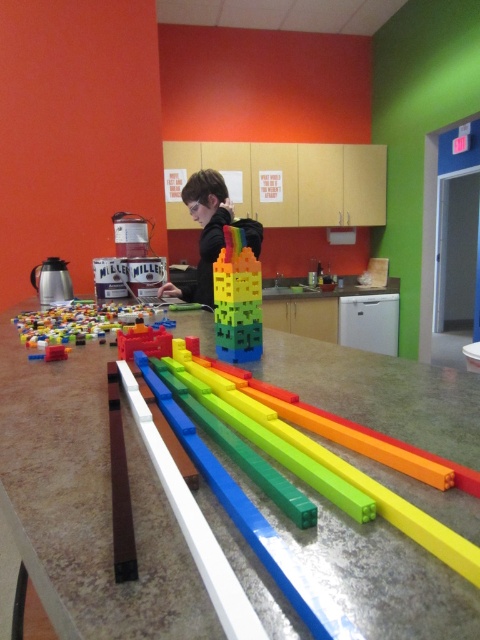
From the picture: Does smooth plastic table at center have a greater width compared to translucent plastic blocks at lower left?

Indeed, smooth plastic table at center has a greater width compared to translucent plastic blocks at lower left.

How far apart are smooth plastic table at center and translucent plastic blocks at lower left?

smooth plastic table at center is 9.49 inches away from translucent plastic blocks at lower left.

You are a GUI agent. You are given a task and a screenshot of the screen. Output one action in this format:
    pyautogui.click(x=<x>, y=<y>)
    Task: Click on the smooth plastic table at center
    Image resolution: width=480 pixels, height=640 pixels.
    Given the screenshot: What is the action you would take?
    pyautogui.click(x=87, y=502)

Who is more forward, (132, 307) or (207, 269)?

Point (132, 307) is more forward.

Between translucent plastic blocks at lower left and matte black hoodie at center, which one is positioned higher?

matte black hoodie at center is above.

Is point (119, 312) less distant than point (217, 176)?

Yes, it is.

Locate an element on the screen. translucent plastic blocks at lower left is located at coordinates click(84, 323).

Is point (232, 236) behind point (39, 330)?

No, (232, 236) is closer to viewer.

Is point (230, 256) less distant than point (144, 308)?

Yes, point (230, 256) is closer to viewer.

You are a GUI agent. You are given a task and a screenshot of the screen. Output one action in this format:
    pyautogui.click(x=<x>, y=<y>)
    Task: Click on the rainbow plastic blocks at center
    The width and height of the screenshot is (480, 640).
    Given the screenshot: What is the action you would take?
    pyautogui.click(x=237, y=300)